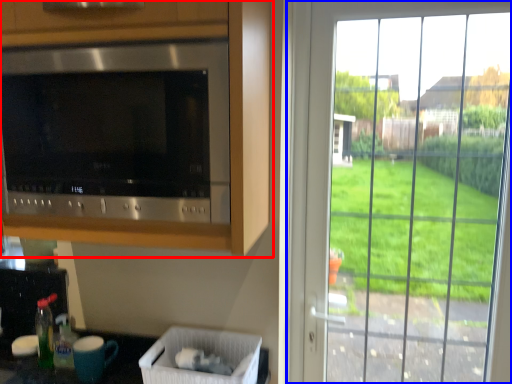
Question: Which object appears farthest to the camera in this image, cabinetry (highlighted by a red box) or window (highlighted by a blue box)?

Choices:
 (A) cabinetry
 (B) window

Answer: (B)